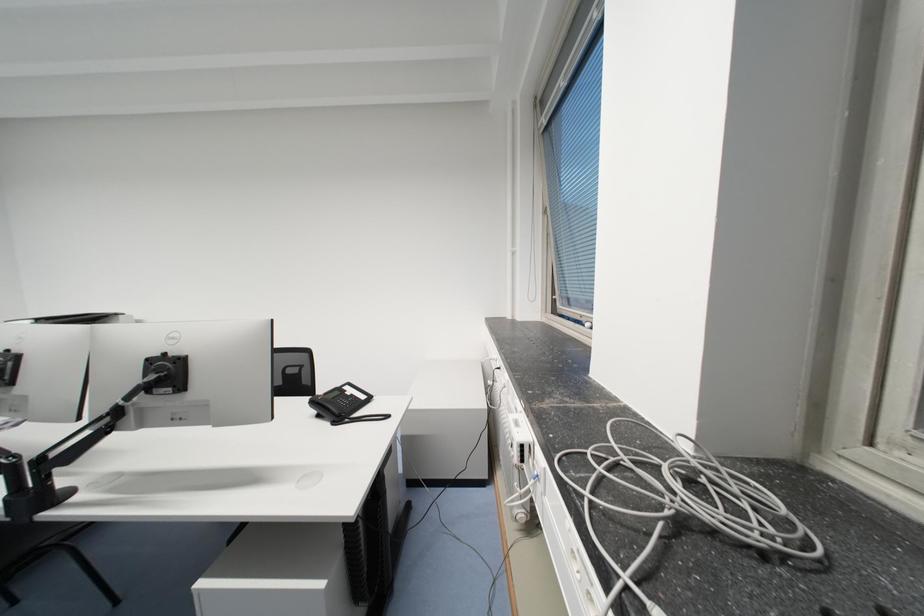
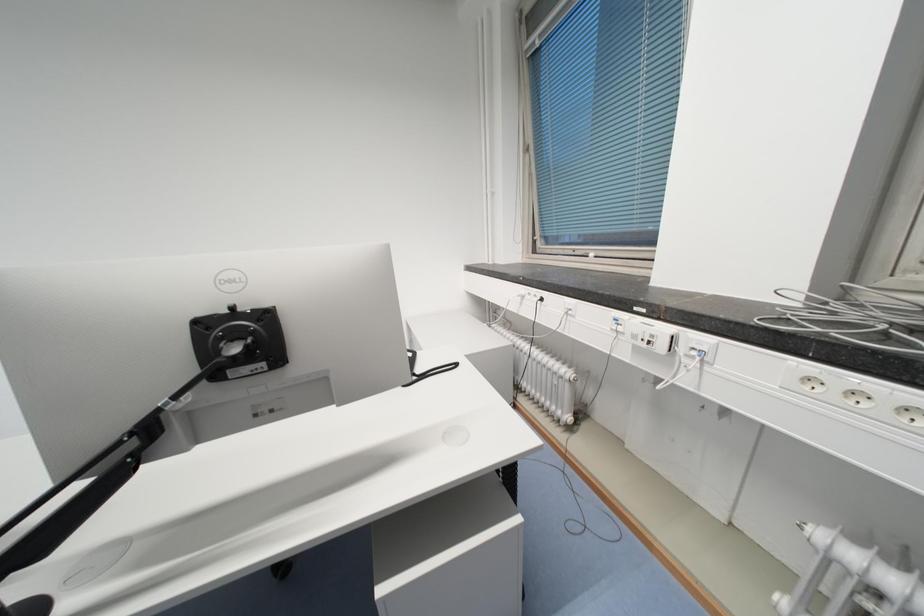
Question: What movement of the cameraman would produce the second image?

Choices:
 (A) Left
 (B) Right
 (C) Forward
 (D) Backward

Answer: (A)